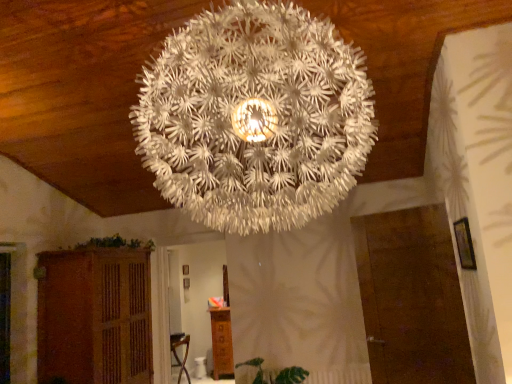
Question: Is green leafy plant at lower left, acting as the 2th plant starting from the bottom, bigger or smaller than wooden cabinet at lower center, which is the second furniture in left-to-right order?

Choices:
 (A) small
 (B) big

Answer: (A)

Question: In terms of height, does green leafy plant at lower left, which is the second plant from right to left, look taller or shorter compared to wooden cabinet at lower center, which is the 1th furniture in right-to-left order?

Choices:
 (A) short
 (B) tall

Answer: (A)

Question: Which of these objects is positioned farthest from the green leafy plant at lower center, which ranks as the 2th plant in top-to-bottom order?

Choices:
 (A) brown wooden cabinet at lower left, the first furniture from the front
 (B) white textured lamp at center
 (C) green leafy plant at lower left, acting as the 2th plant starting from the bottom
 (D) wooden cabinet at lower center, which is the second furniture in left-to-right order

Answer: (B)

Question: Which of these objects is positioned farthest from the green leafy plant at lower center, the 2th plant positioned from the left?

Choices:
 (A) wooden cabinet at lower center, which is counted as the first furniture, starting from the back
 (B) brown wooden cabinet at lower left, the first furniture from the front
 (C) green leafy plant at lower left, the first plant from the left
 (D) white textured lamp at center

Answer: (D)